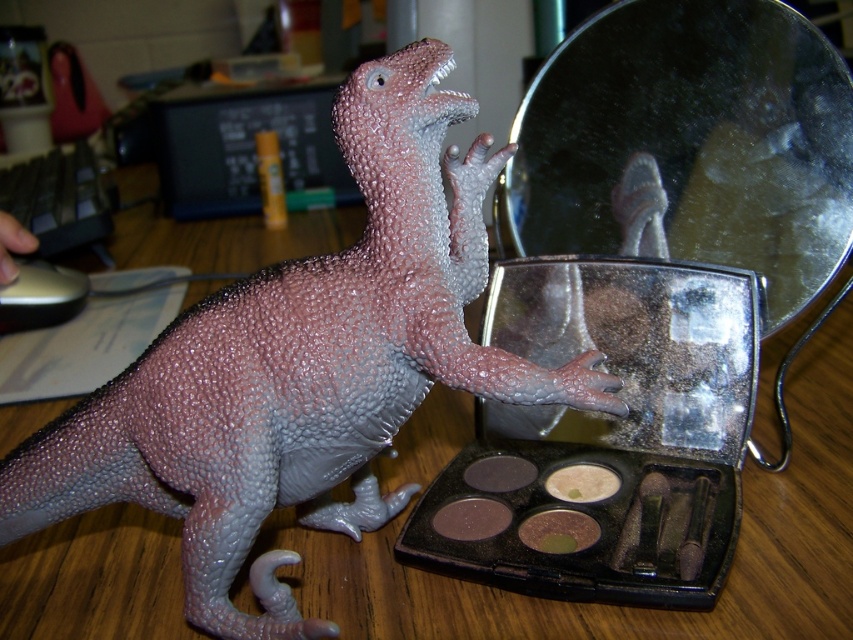
Consider the image. You are a makeup artist trying to place a new eyeshadow compact between the metallic reflective mirror at center and the matte brown powder at center. The compact is 3 cm in diameter. Can you fit it between them?

The metallic reflective mirror at center is wider than the matte brown powder at center. Since the mirror is wider, there might be enough space between them to fit the 3 cm compact, but it depends on the exact distance between their edges. However, based on the information provided, we cannot determine the available space between them, only their relative widths.

You are organizing a child safety check in a classroom. You see the matte pink dinosaur at center and the brown matte powder at center on a desk. According to safety guidelines, small objects must be kept away from children to prevent choking hazards. Which object should you be more concerned about?

The brown matte powder at center is smaller in size than the matte pink dinosaur at center, so it poses a higher choking hazard risk and should be a greater concern during the safety check.